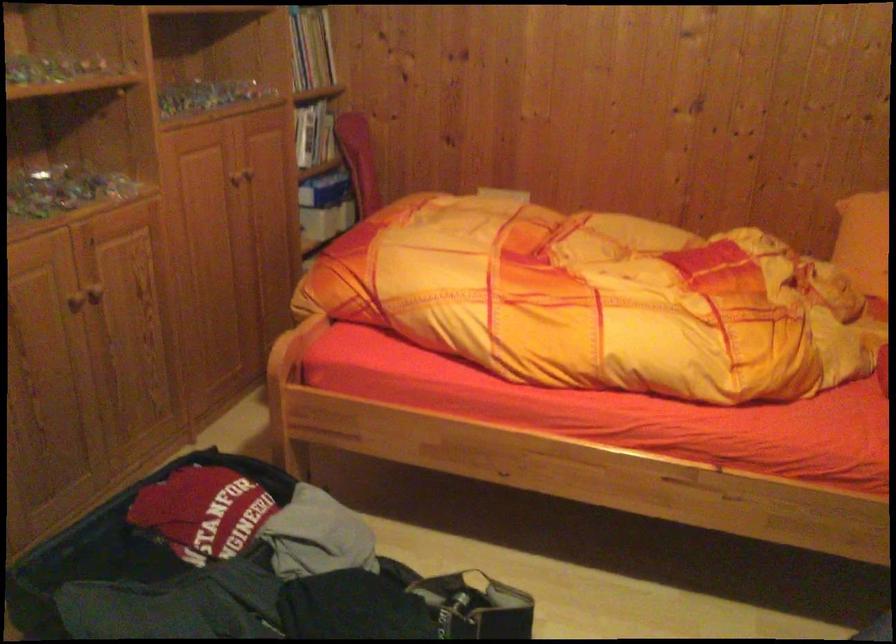
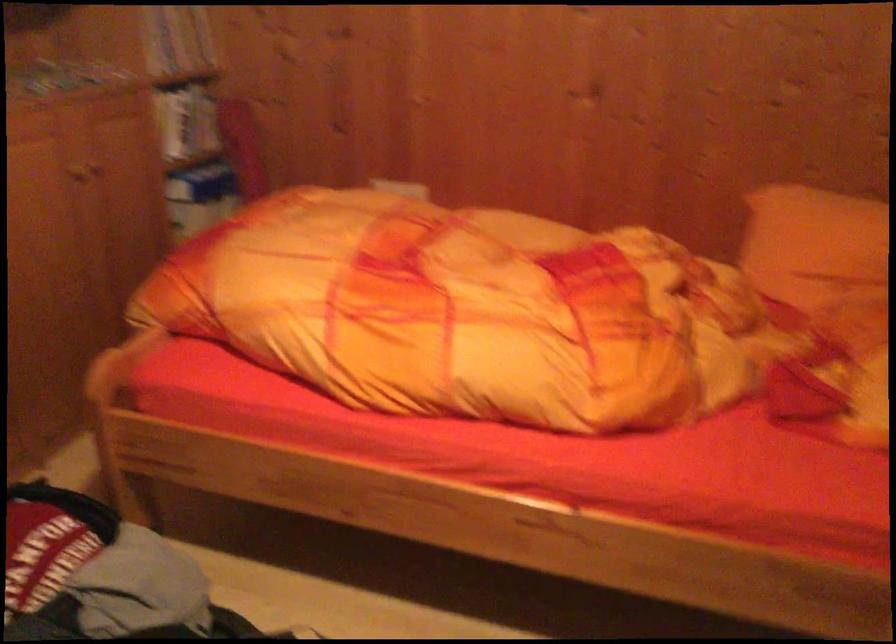
The images are taken continuously from a first-person perspective. In which direction are you moving?

The movement direction of the cameraman is right, forward.